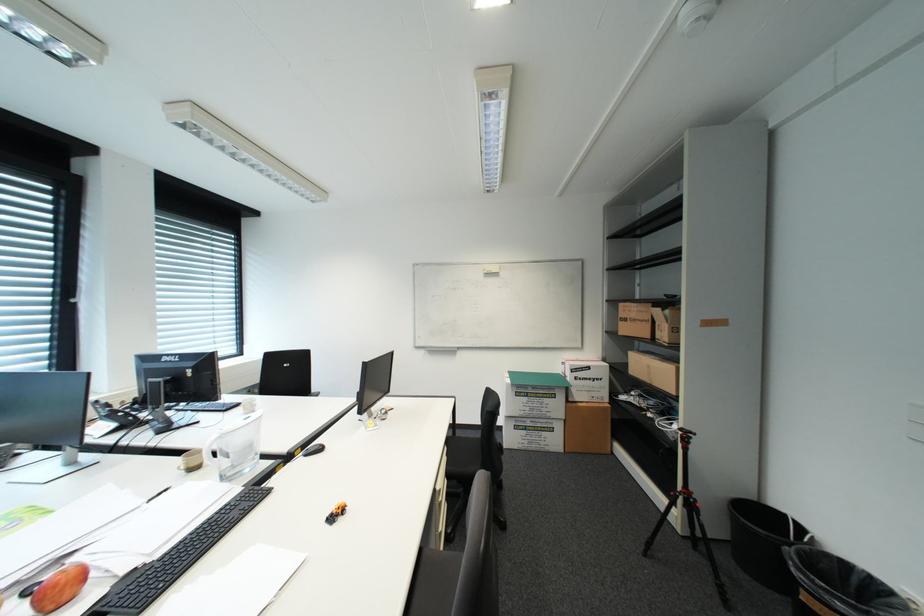
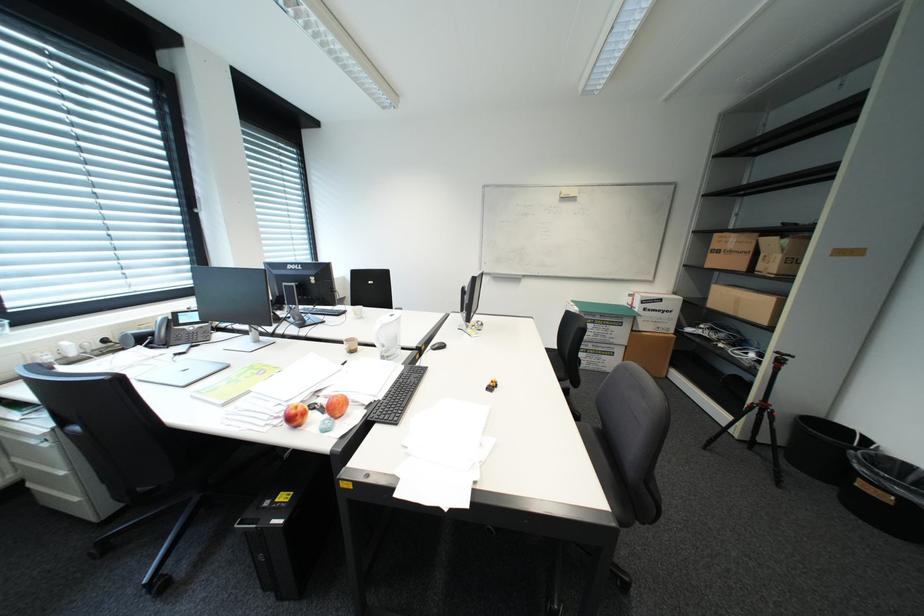
Question: What movement of the cameraman would produce the second image?

Choices:
 (A) Left
 (B) Right
 (C) Forward
 (D) Backward

Answer: (A)